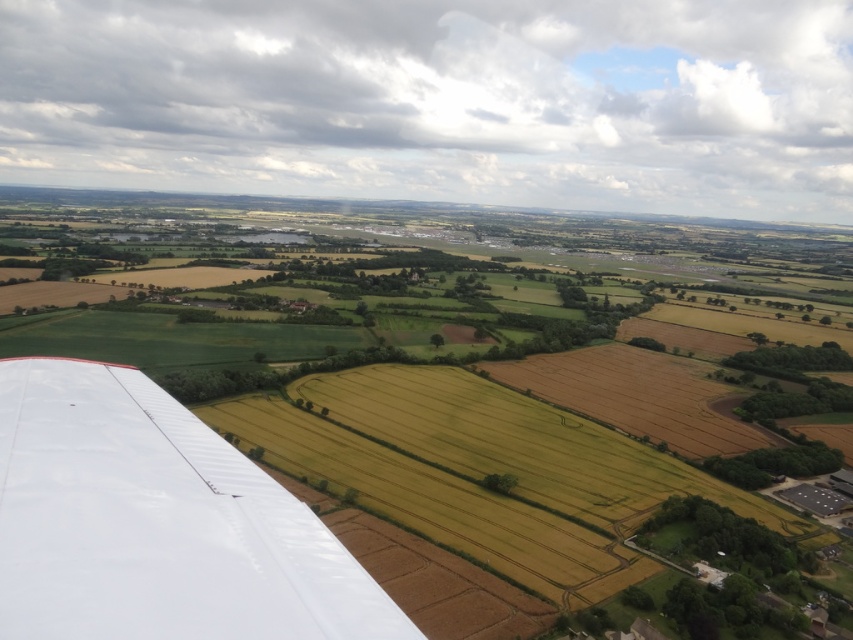
You are a passenger on a plane and looking out the window. You see the green grassy field at center and the white matte wing at lower left. Which object is closer to you?

The white matte wing at lower left is closer to you because it is positioned in front of the green grassy field at center, which is further away.

You are a pilot flying over a rural area and see a green grassy field at center. Can you confirm if the point marked at coordinates (x=453, y=396) corresponds to this field?

Yes, the green grassy field at center is represented by point (x=453, y=396).

You are a pilot flying at an altitude of 1,000 feet. You notice a point of interest at point (538, 548) in your view. Based on your current altitude, can you estimate whether you are directly above this point or further away from it?

The distance of point (538, 548) from camera is 519.75 feet. Since your altitude is 1,000 feet, you are further away from the point than your altitude, so you are not directly above it.